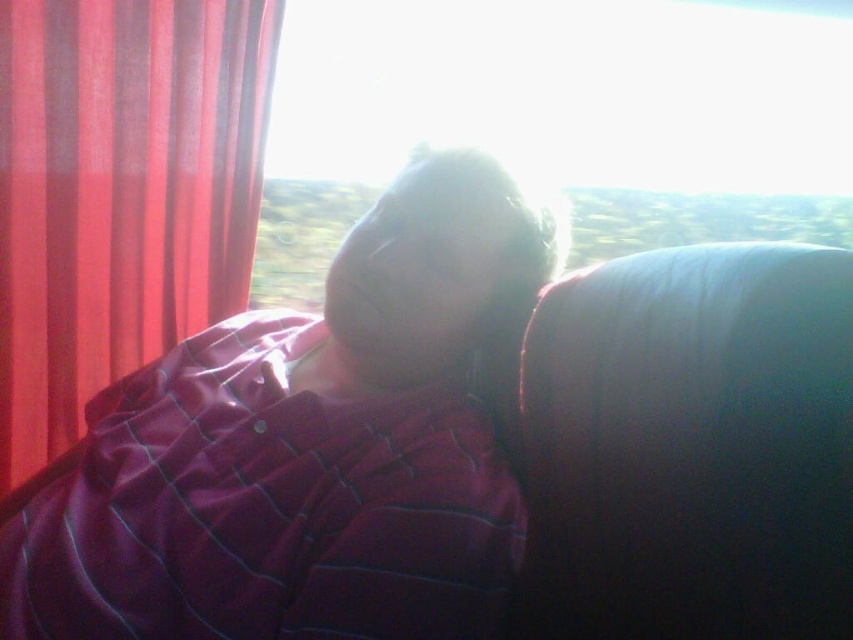
You are a passenger on a moving vehicle and want to check if there is a window nearby where you can see outside. Based on the scene, is the point at coordinates point (560, 116) on the vehicle a transparent glass where you can see outside?

The point (560, 116) indicates transparent glass at upper center, so yes, you can see outside through it since it is transparent glass.